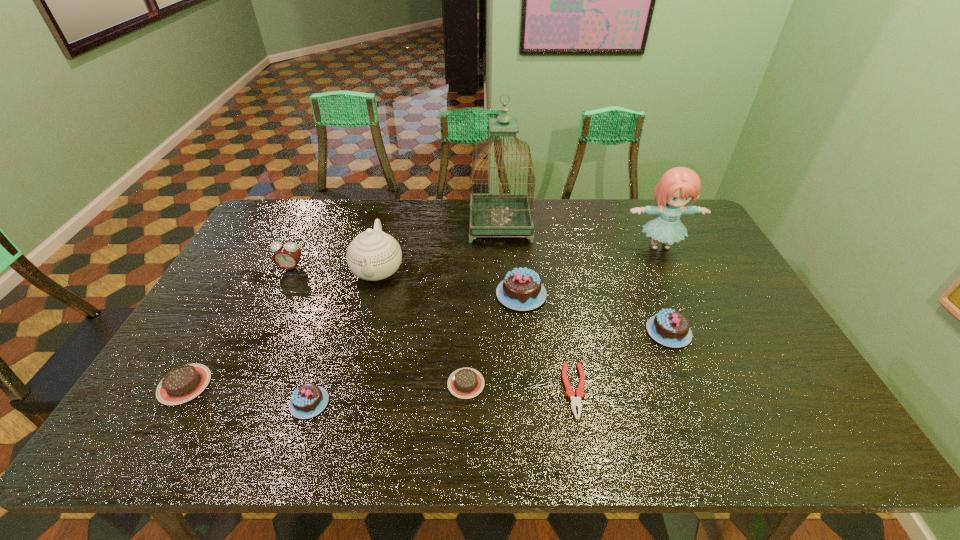
Where is `vacant region that satisfies the following two spatial constraints: 1. on the back side of the sixth shortest object; 2. on the left side of the left brown chocolate cake`? vacant region that satisfies the following two spatial constraints: 1. on the back side of the sixth shortest object; 2. on the left side of the left brown chocolate cake is located at coordinates (237, 294).

The image size is (960, 540). Identify the location of free space that satisfies the following two spatial constraints: 1. on the spout of the third tallest object; 2. on the left side of the tallest chocolate cake. (372, 294).

Locate an element on the screen. vacant space that satisfies the following two spatial constraints: 1. on the spout of the eighth shortest object; 2. on the left side of the right brown chocolate cake is located at coordinates (348, 383).